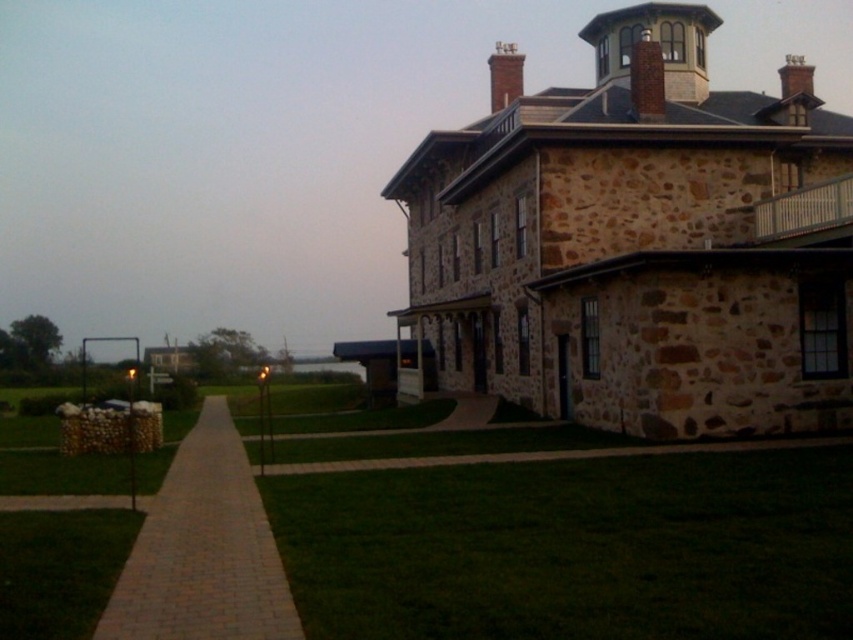
Can you confirm if brick paved path at lower left is positioned above green grass at lower left?

Actually, brick paved path at lower left is below green grass at lower left.

Does brick paved path at lower left have a lesser width compared to green grass at lower left?

In fact, brick paved path at lower left might be wider than green grass at lower left.

Where is `brick paved path at lower left`? This screenshot has height=640, width=853. brick paved path at lower left is located at coordinates (202, 550).

Which is in front, point (724, 412) or point (824, 525)?

Point (824, 525) is more forward.

Can you confirm if brown stone tower at upper right is positioned below green grass at lower center?

Actually, brown stone tower at upper right is above green grass at lower center.

Image resolution: width=853 pixels, height=640 pixels. I want to click on brown stone tower at upper right, so click(639, 241).

Which is in front, point (279, 504) or point (196, 461)?

Positioned in front is point (279, 504).

What do you see at coordinates (573, 548) in the screenshot?
I see `green grass at lower center` at bounding box center [573, 548].

This screenshot has width=853, height=640. I want to click on green grass at lower center, so click(573, 548).